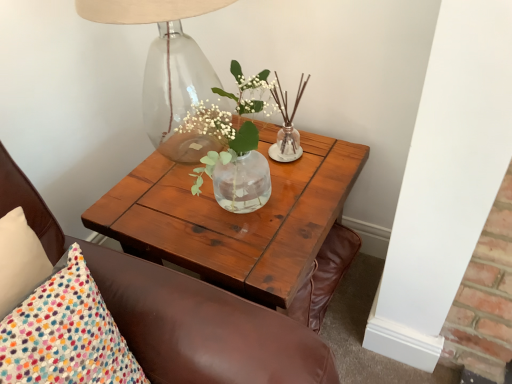
Question: Is transparent glass table lamp at upper left in front of brown leather chair at upper left?

Choices:
 (A) yes
 (B) no

Answer: (B)

Question: Is transparent glass table lamp at upper left not near brown leather chair at upper left?

Choices:
 (A) no
 (B) yes

Answer: (A)

Question: From the image's perspective, is transparent glass table lamp at upper left below brown leather chair at upper left?

Choices:
 (A) yes
 (B) no

Answer: (B)

Question: From the image's perspective, is transparent glass table lamp at upper left on brown leather chair at upper left?

Choices:
 (A) no
 (B) yes

Answer: (B)

Question: Does transparent glass table lamp at upper left have a greater height compared to brown leather chair at upper left?

Choices:
 (A) yes
 (B) no

Answer: (B)

Question: Relative to brown leather chair at upper left, is wooden coffee table at center in front or behind?

Choices:
 (A) behind
 (B) front

Answer: (A)

Question: Is wooden coffee table at center situated inside brown leather chair at upper left or outside?

Choices:
 (A) outside
 (B) inside

Answer: (A)

Question: Looking at their shapes, would you say wooden coffee table at center is wider or thinner than brown leather chair at upper left?

Choices:
 (A) wide
 (B) thin

Answer: (A)

Question: Does point click(x=288, y=299) appear closer or farther from the camera than point click(x=3, y=198)?

Choices:
 (A) closer
 (B) farther

Answer: (B)

Question: From a real-world perspective, is wooden coffee table at center positioned above or below transparent glass table lamp at upper left?

Choices:
 (A) above
 (B) below

Answer: (B)

Question: Is point (318, 139) positioned closer to the camera than point (169, 114)?

Choices:
 (A) closer
 (B) farther

Answer: (A)

Question: From the image's perspective, is wooden coffee table at center above or below transparent glass table lamp at upper left?

Choices:
 (A) below
 (B) above

Answer: (A)

Question: In terms of width, does wooden coffee table at center look wider or thinner when compared to transparent glass table lamp at upper left?

Choices:
 (A) wide
 (B) thin

Answer: (A)

Question: In terms of height, does brown leather chair at upper left look taller or shorter compared to wooden coffee table at center?

Choices:
 (A) tall
 (B) short

Answer: (A)

Question: From the image's perspective, is brown leather chair at upper left above or below wooden coffee table at center?

Choices:
 (A) above
 (B) below

Answer: (B)